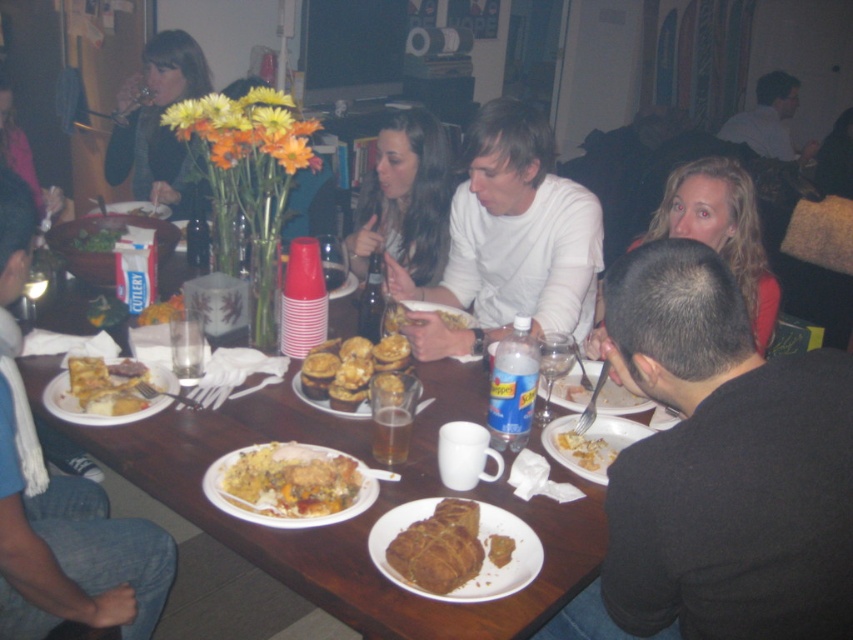
You are a photographer trying to capture a closeup of the golden brown bread at center without including the matte black sweater at upper left in the frame. Based on their relative heights, can you position yourself in a way that achieves this?

The matte black sweater at upper left is taller than the golden brown bread at center. To avoid including it in the frame, position yourself lower so that the shorter golden brown bread at center is framed without the taller matte black sweater at upper left.

From the picture: You are a photographer trying to capture a candid shot of the blonde hair at upper right and the yellow matte bread at center. Since you want to ensure both subjects are in focus, you need to know their sizes relative to each other. Which object is larger?

The blonde hair at upper right is bigger than the yellow matte bread at center, so you should adjust your camera settings to accommodate the size difference for better focus.

You are a guest at this gathering and want to reach for the golden brown bread at center without disturbing the matte black sweater at upper left. Is this possible?

The matte black sweater at upper left is positioned over the golden brown bread at center, so you cannot reach the bread without moving the sweater first.